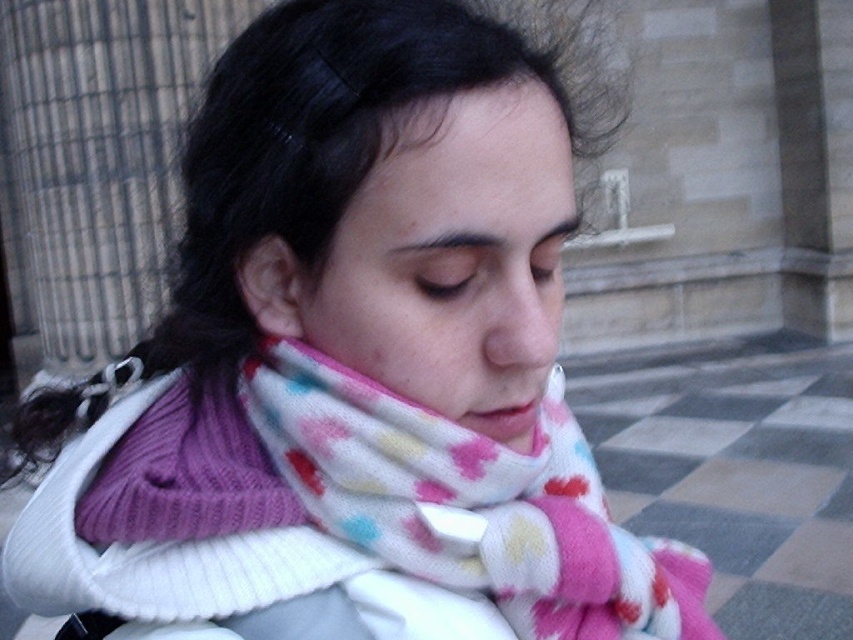
Who is taller, fluffy multicolored scarf at center or matte pink scarf at center?

fluffy multicolored scarf at center

Which is behind, point (469, 541) or point (548, 364)?

Positioned behind is point (469, 541).

Based on the photo, who is more distant from viewer, (273, 420) or (538, 266)?

A: The point (273, 420) is behind.

Image resolution: width=853 pixels, height=640 pixels. I want to click on fluffy multicolored scarf at center, so click(x=471, y=502).